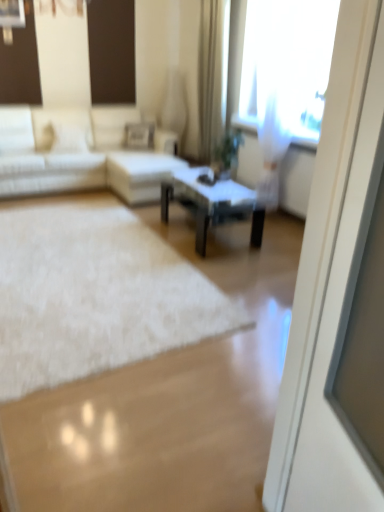
Measure the distance between white fabric couch at left and camera.

4.37 meters.

In order to click on beige fabric curtain at upper center in this screenshot , I will do `click(212, 74)`.

What do you see at coordinates (212, 74) in the screenshot? I see `beige fabric curtain at upper center` at bounding box center [212, 74].

Where is `transparent curtain at upper right`? transparent curtain at upper right is located at coordinates (287, 64).

The image size is (384, 512). I want to click on white fabric couch at left, so click(x=78, y=154).

From a real-world perspective, between white fluffy rug at center and beige fabric curtain at upper center, who is vertically higher?

In real-world perspective, beige fabric curtain at upper center is above.

Is white fluffy rug at center not within beige fabric curtain at upper center?

Yes.

Are white fluffy rug at center and beige fabric curtain at upper center far apart?

Indeed, white fluffy rug at center is not near beige fabric curtain at upper center.

Considering the relative positions of white fabric couch at left and white glossy screen door at right in the image provided, is white fabric couch at left to the right of white glossy screen door at right from the viewer's perspective?

Incorrect, white fabric couch at left is not on the right side of white glossy screen door at right.

Can you confirm if white fabric couch at left is smaller than white glossy screen door at right?

Actually, white fabric couch at left might be larger than white glossy screen door at right.

The width and height of the screenshot is (384, 512). In order to click on studio couch that is under the white glossy screen door at right (from a real-world perspective) in this screenshot , I will do `click(78, 154)`.

Is white fabric couch at left in front of white glossy screen door at right?

No, it is behind white glossy screen door at right.

Choose the correct answer: Is white fluffy rug at center inside white glossy screen door at right or outside it?

white fluffy rug at center is not enclosed by white glossy screen door at right.

From the image's perspective, is white fluffy rug at center positioned above or below white glossy screen door at right?

Clearly, from the image's perspective, white fluffy rug at center is above white glossy screen door at right.

Does point (74, 233) come in front of point (296, 384)?

No, (74, 233) is behind (296, 384).

From the image's perspective, would you say beige fabric curtain at upper center is positioned over white fabric couch at left?

Yes, from the image's perspective, beige fabric curtain at upper center is over white fabric couch at left.

Does beige fabric curtain at upper center have a greater width compared to white fabric couch at left?

Incorrect, the width of beige fabric curtain at upper center does not surpass that of white fabric couch at left.

Does beige fabric curtain at upper center appear on the right side of white fabric couch at left?

Indeed, beige fabric curtain at upper center is positioned on the right side of white fabric couch at left.

Is beige fabric curtain at upper center next to white fabric couch at left?

No.

From the image's perspective, between black glass coffee table at center and beige fabric curtain at upper center, who is located below?

black glass coffee table at center appears lower in the image.

Measure the distance from black glass coffee table at center to beige fabric curtain at upper center.

A distance of 4.20 feet exists between black glass coffee table at center and beige fabric curtain at upper center.

Is black glass coffee table at center not close to beige fabric curtain at upper center?

black glass coffee table at center is positioned a significant distance from beige fabric curtain at upper center.

Is black glass coffee table at center positioned with its back to beige fabric curtain at upper center?

No, black glass coffee table at center's orientation is not away from beige fabric curtain at upper center.

Which object is thinner, beige fabric curtain at upper center or black glass coffee table at center?

beige fabric curtain at upper center.

Based on the photo, between beige fabric curtain at upper center and black glass coffee table at center, which one is positioned behind?

beige fabric curtain at upper center is further away from the camera.

In the scene shown: Does beige fabric curtain at upper center appear on the left side of black glass coffee table at center?

In fact, beige fabric curtain at upper center is to the right of black glass coffee table at center.

From a real-world perspective, is transparent curtain at upper right physically above white glossy screen door at right?

Yes, from a real-world perspective, transparent curtain at upper right is over white glossy screen door at right

From the image's perspective, does transparent curtain at upper right appear lower than white glossy screen door at right?

No, from the image's perspective, transparent curtain at upper right is not below white glossy screen door at right.

Is transparent curtain at upper right not near white glossy screen door at right?

transparent curtain at upper right is positioned a significant distance from white glossy screen door at right.

Considering the relative positions of transparent curtain at upper right and white glossy screen door at right in the image provided, is transparent curtain at upper right to the right of white glossy screen door at right from the viewer's perspective?

Indeed, transparent curtain at upper right is positioned on the right side of white glossy screen door at right.

Locate an element on the screen. The height and width of the screenshot is (512, 384). mat to the left of beige fabric curtain at upper center is located at coordinates (94, 292).

What are the coordinates of `screen door located below the white fabric couch at left (from the image's perspective)` in the screenshot? It's located at (331, 280).

Which object lies nearer to the anchor point black glass coffee table at center, white glossy screen door at right or transparent curtain at upper right?

The object closer to black glass coffee table at center is transparent curtain at upper right.

From the image, which object appears to be nearer to white fluffy rug at center, white glossy screen door at right or transparent curtain at upper right?

The object closer to white fluffy rug at center is white glossy screen door at right.

Looking at the image, which one is located closer to white fabric couch at left, white fluffy rug at center or black glass coffee table at center?

black glass coffee table at center is closer to white fabric couch at left.

Considering their positions, is white glossy screen door at right positioned further to white fluffy rug at center than white fabric couch at left?

white glossy screen door at right is positioned further to the anchor white fluffy rug at center.

Which object lies nearer to the anchor point white glossy screen door at right, white fluffy rug at center or transparent curtain at upper right?

The object closer to white glossy screen door at right is white fluffy rug at center.

Based on their spatial positions, is beige fabric curtain at upper center or white fabric couch at left further from transparent curtain at upper right?

white fabric couch at left.

Which object lies further to the anchor point beige fabric curtain at upper center, white fluffy rug at center or black glass coffee table at center?

Based on the image, white fluffy rug at center appears to be further to beige fabric curtain at upper center.

From the image, which object appears to be farther from transparent curtain at upper right, white fabric couch at left or black glass coffee table at center?

Based on the image, white fabric couch at left appears to be further to transparent curtain at upper right.

Find the location of a particular element. The width and height of the screenshot is (384, 512). window between beige fabric curtain at upper center and black glass coffee table at center in the up-down direction is located at coordinates (287, 64).

The width and height of the screenshot is (384, 512). What are the coordinates of `mat between white glossy screen door at right and black glass coffee table at center in the front-back direction` in the screenshot? It's located at (94, 292).

This screenshot has width=384, height=512. I want to click on mat located between white glossy screen door at right and transparent curtain at upper right in the depth direction, so click(x=94, y=292).

Where is `coffee table between white glossy screen door at right and beige fabric curtain at upper center from front to back`? The height and width of the screenshot is (512, 384). coffee table between white glossy screen door at right and beige fabric curtain at upper center from front to back is located at coordinates [212, 203].